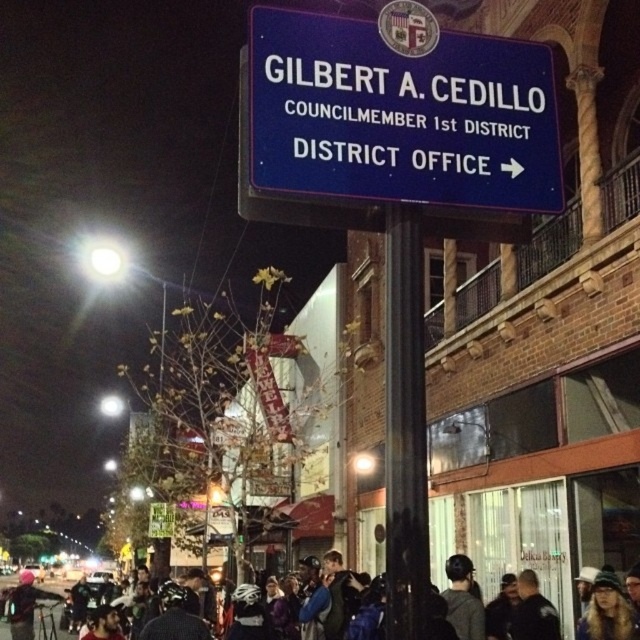
Question: Among these points, which one is nearest to the camera?

Choices:
 (A) (257, 113)
 (B) (45, 598)
 (C) (388, 433)

Answer: (A)

Question: Considering the real-world distances, which object is closest to the dark blue jacket at lower center?

Choices:
 (A) black glossy pole at center
 (B) blue metallic sign at upper center

Answer: (B)

Question: Does blue metallic sign at upper center lie in front of black glossy pole at center?

Choices:
 (A) yes
 (B) no

Answer: (B)

Question: Is blue metallic sign at upper center below dark blue jacket at lower center?

Choices:
 (A) yes
 (B) no

Answer: (B)

Question: Is blue metallic sign at upper center to the right of dark blue jacket at lower center from the viewer's perspective?

Choices:
 (A) yes
 (B) no

Answer: (A)

Question: Which object is the closest to the blue metallic sign at upper center?

Choices:
 (A) dark blue jacket at lower center
 (B) black glossy pole at center

Answer: (B)